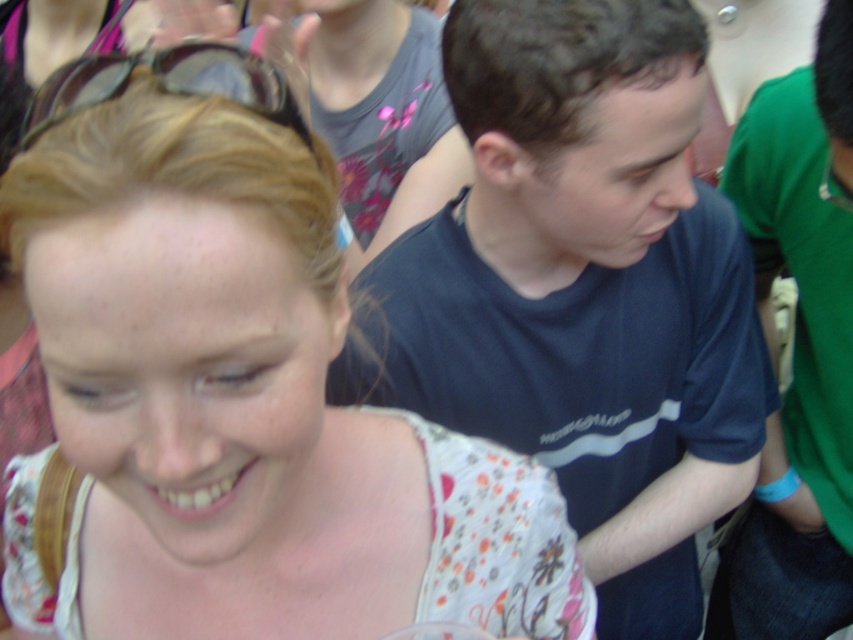
Question: Which object is farther from the camera taking this photo?

Choices:
 (A) floral fabric dress at center
 (B) matte gray shirt at upper center
 (C) dark blue t-shirt at center

Answer: (B)

Question: Which object is positioned closest to the matte gray shirt at upper center?

Choices:
 (A) floral fabric dress at center
 (B) black plastic goggles at upper left
 (C) green cotton shirt at right

Answer: (C)

Question: Is dark blue t-shirt at center above matte gray shirt at upper center?

Choices:
 (A) no
 (B) yes

Answer: (A)

Question: In this image, where is green cotton shirt at right located relative to matte gray shirt at upper center?

Choices:
 (A) below
 (B) above

Answer: (A)

Question: Can you confirm if green cotton shirt at right is wider than black plastic goggles at upper left?

Choices:
 (A) yes
 (B) no

Answer: (A)

Question: Among these objects, which one is farthest from the camera?

Choices:
 (A) green cotton shirt at right
 (B) matte gray shirt at upper center
 (C) black plastic goggles at upper left

Answer: (B)